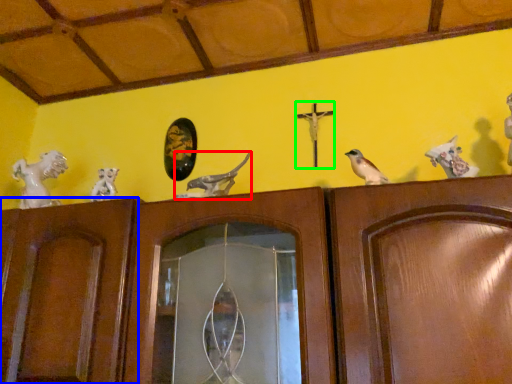
Question: Which is nearer to the animal (highlighted by a red box)? door (highlighted by a blue box) or crucifix (highlighted by a green box).

Choices:
 (A) door
 (B) crucifix

Answer: (B)